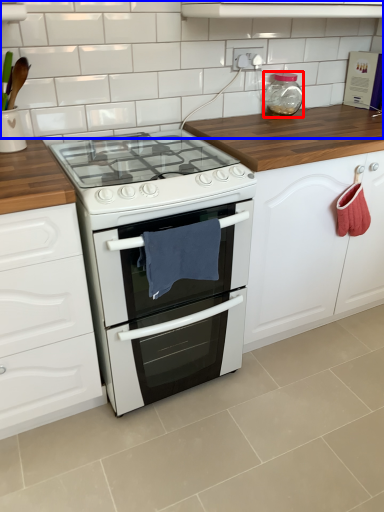
Question: Which point is further to the camera, bottle (highlighted by a red box) or tile (highlighted by a blue box)?

Choices:
 (A) bottle
 (B) tile

Answer: (A)